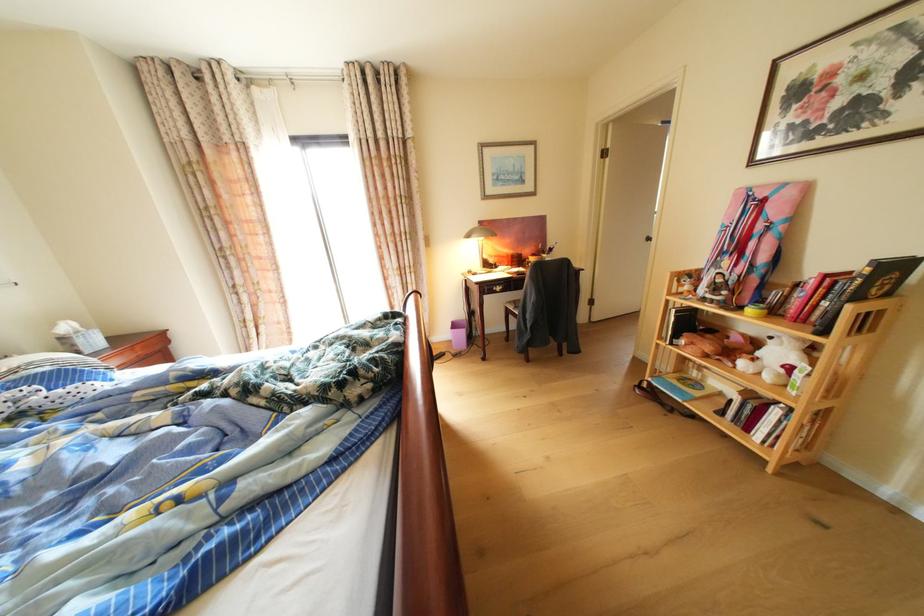
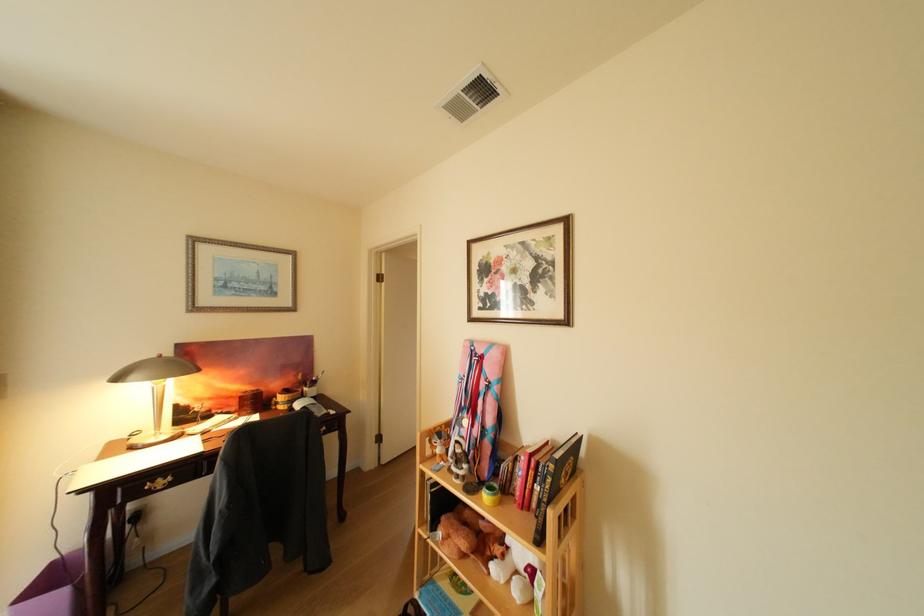
Locate, in the second image, the point that corresponds to the point at 699,334 in the first image.

(456, 519)